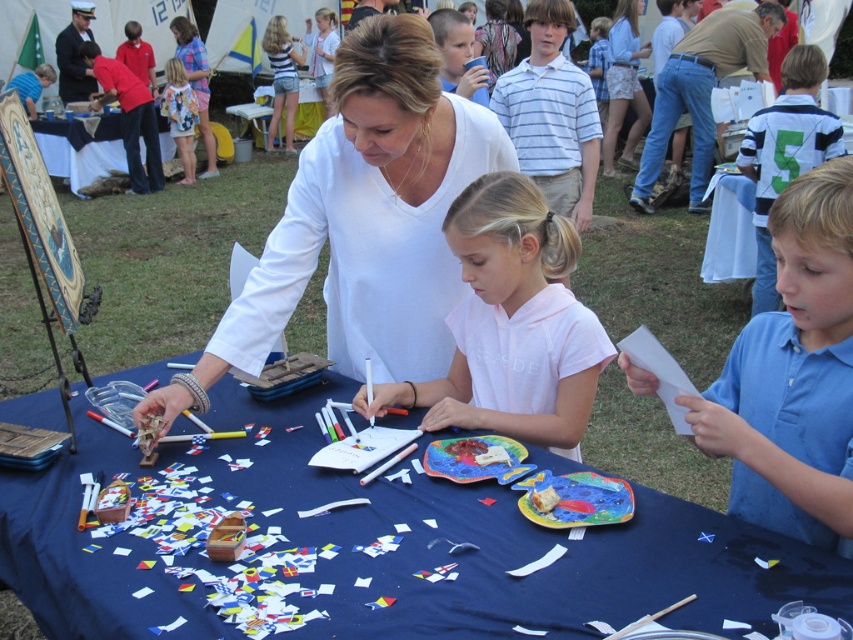
Question: Observing the image, what is the correct spatial positioning of blue fabric table at center in reference to white plastic table at upper left?

Choices:
 (A) right
 (B) left

Answer: (A)

Question: Among these points, which one is farthest from the camera?

Choices:
 (A) (410, 148)
 (B) (752, 428)
 (C) (65, 125)
 (D) (564, 115)

Answer: (C)

Question: Which object appears closest to the camera in this image?

Choices:
 (A) striped cotton shirt at upper center
 (B) white matte shirt at center
 (C) blue fabric table at center
 (D) white plastic table at upper left

Answer: (C)

Question: Considering the relative positions of white matte paper at center and white plastic table at upper left in the image provided, where is white matte paper at center located with respect to white plastic table at upper left?

Choices:
 (A) above
 (B) below

Answer: (B)

Question: Estimate the real-world distances between objects in this image. Which object is closer to the white matte shirt at center?

Choices:
 (A) white plastic table at upper left
 (B) blue smooth shirt at right

Answer: (B)

Question: Can you confirm if white matte paper at center is positioned to the right of white plastic table at upper left?

Choices:
 (A) yes
 (B) no

Answer: (A)